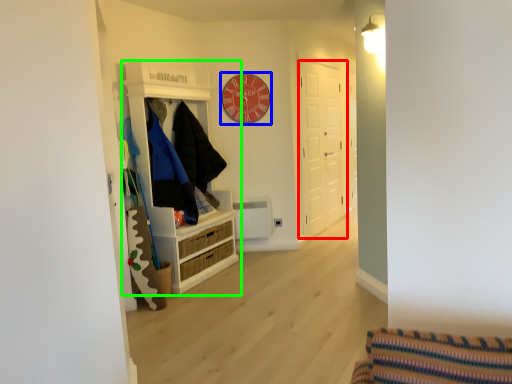
Question: Estimate the real-world distances between objects in this image. Which object is closer to door (highlighted by a red box), clock (highlighted by a blue box) or cabinetry (highlighted by a green box)?

Choices:
 (A) clock
 (B) cabinetry

Answer: (A)